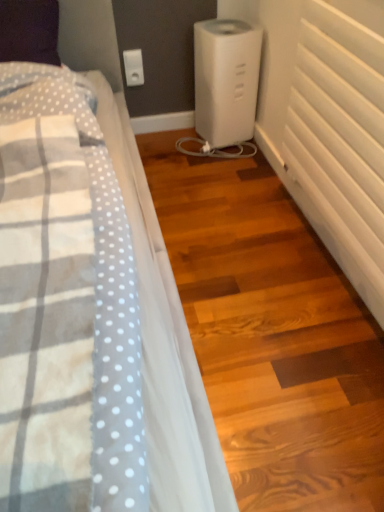
Question: Would you say white plastic humidifier at center is part of white plastic electric outlet at upper center's contents?

Choices:
 (A) no
 (B) yes

Answer: (A)

Question: From a real-world perspective, does white plastic electric outlet at upper center sit lower than white plastic humidifier at center?

Choices:
 (A) yes
 (B) no

Answer: (B)

Question: Is white plastic electric outlet at upper center positioned behind white plastic humidifier at center?

Choices:
 (A) no
 (B) yes

Answer: (B)

Question: Does white plastic electric outlet at upper center have a lesser width compared to white plastic humidifier at center?

Choices:
 (A) yes
 (B) no

Answer: (A)

Question: Can you confirm if white plastic electric outlet at upper center is smaller than white plastic humidifier at center?

Choices:
 (A) no
 (B) yes

Answer: (B)

Question: Is white plastic electric outlet at upper center at the right side of white plastic humidifier at center?

Choices:
 (A) no
 (B) yes

Answer: (A)

Question: Considering the relative sizes of white matte radiator at right and white plastic humidifier at center in the image provided, is white matte radiator at right shorter than white plastic humidifier at center?

Choices:
 (A) yes
 (B) no

Answer: (B)

Question: Considering the relative positions of white matte radiator at right and white plastic humidifier at center in the image provided, is white matte radiator at right to the right of white plastic humidifier at center from the viewer's perspective?

Choices:
 (A) no
 (B) yes

Answer: (B)

Question: From a real-world perspective, is white matte radiator at right beneath white plastic humidifier at center?

Choices:
 (A) yes
 (B) no

Answer: (B)

Question: Is white matte radiator at right closer to the viewer compared to white plastic humidifier at center?

Choices:
 (A) yes
 (B) no

Answer: (A)

Question: Is white matte radiator at right not inside white plastic humidifier at center?

Choices:
 (A) yes
 (B) no

Answer: (A)

Question: Does white matte radiator at right have a larger size compared to white plastic humidifier at center?

Choices:
 (A) no
 (B) yes

Answer: (B)

Question: From the image's perspective, would you say white plastic electric outlet at upper center is shown under white matte radiator at right?

Choices:
 (A) yes
 (B) no

Answer: (B)